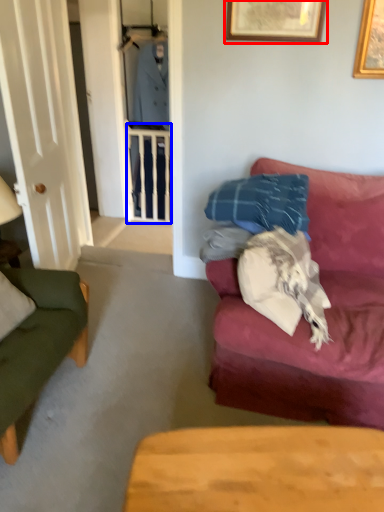
Question: Which point is closer to the camera, picture frame (highlighted by a red box) or balustrade (highlighted by a blue box)?

Choices:
 (A) picture frame
 (B) balustrade

Answer: (A)